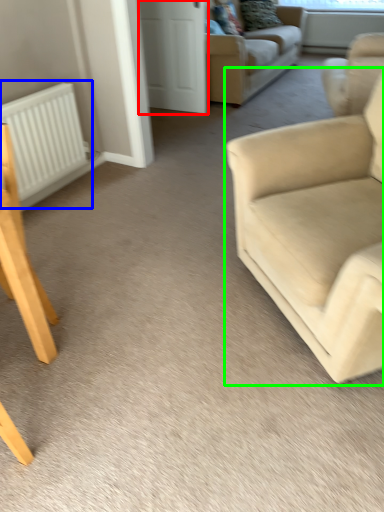
Question: Based on their relative distances, which object is nearer to glass door (highlighted by a red box)? Choose from radiator (highlighted by a blue box) and studio couch (highlighted by a green box).

Choices:
 (A) radiator
 (B) studio couch

Answer: (A)